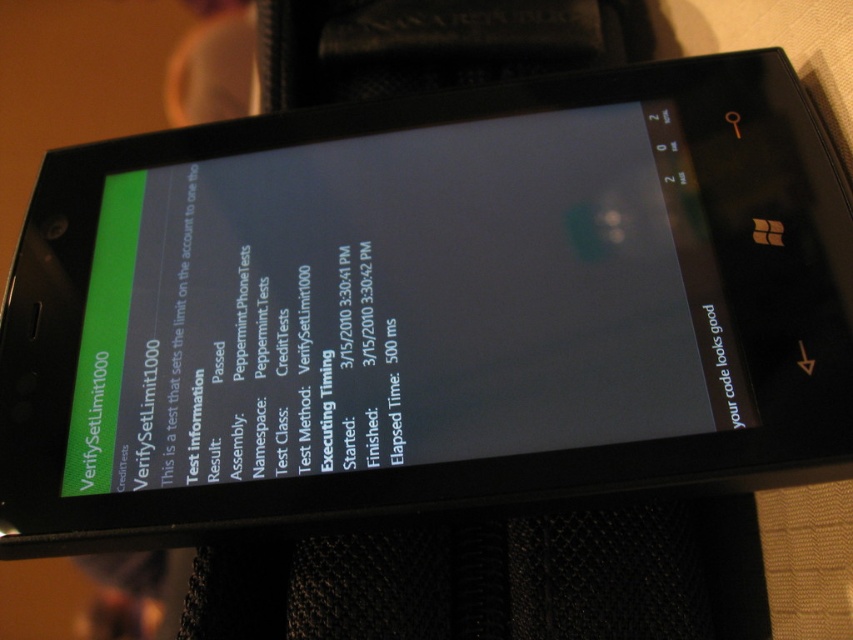
You are a software tester reviewing the test results on the smartphone screen. You notice two points plotted on the graph within the test log. The first point is at coordinates point (695, 369) and the second at point (260, 198). Based on their positions, which point is closer to the viewer on the screen?

Point (695, 369) is in front of point (260, 198), so the first point is closer to the viewer on the screen.

You are a software tester looking at the smartphone screen. You notice the matte black screen at center and the green matte text at upper left. Which object occupies more vertical space on the screen?

The matte black screen at center has a greater height compared to the green matte text at upper left, so it occupies more vertical space.

You are a software tester standing 1.18 meters away from the smartphone screen. You notice a point labeled as point at coordinate (227,205) on the screen. Can you reach out and touch that point on the screen without moving your hand beyond the screen boundaries?

The point at coordinate (227,205) is exactly 1.18 meters away from you. Since you are already standing at that distance, you can comfortably reach out and touch the point on the screen without moving your hand beyond the screen boundaries.